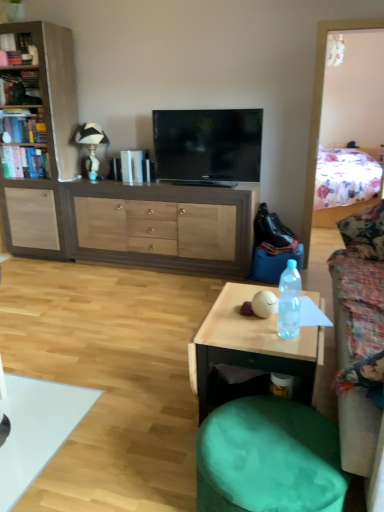
In order to click on free space above wooden table at center (from a real-world perspective) in this screenshot , I will do `click(245, 317)`.